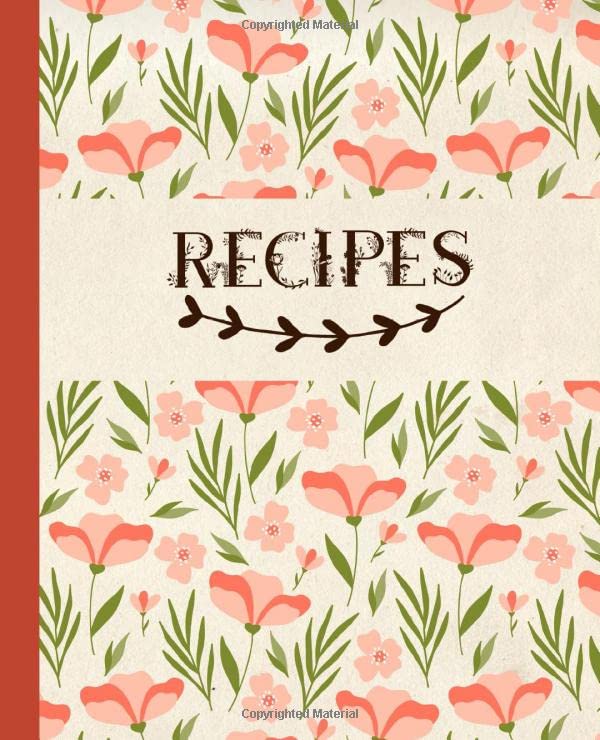
Find the location of a particular element. This screenshot has width=600, height=740. decorative border is located at coordinates (305, 337).